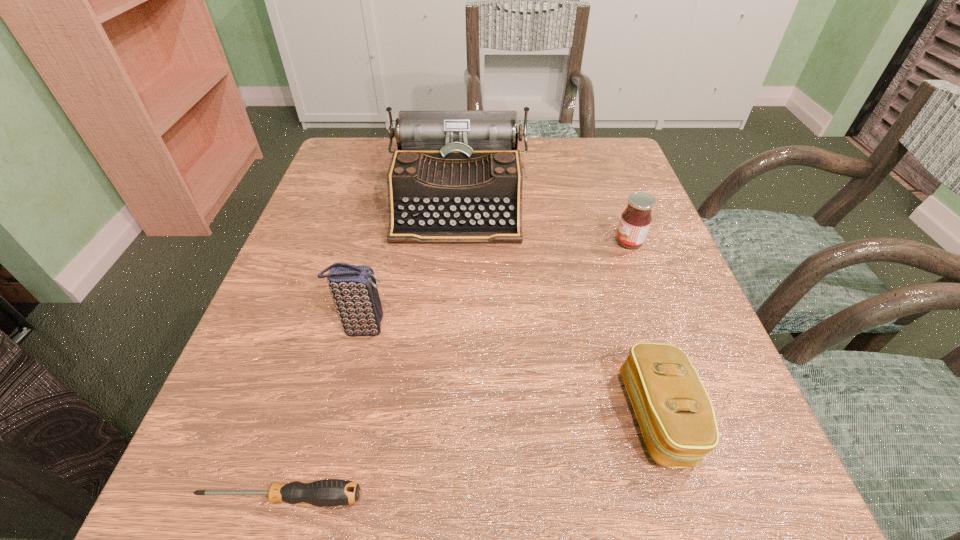
This screenshot has height=540, width=960. I want to click on vacant space located on the label side of the jam, so click(497, 242).

Where is `vacant region located 0.250m on the label side of the jam`? The image size is (960, 540). vacant region located 0.250m on the label side of the jam is located at coordinates (492, 242).

What are the coordinates of `vacant space situated on the label side of the jam` in the screenshot? It's located at (532, 242).

You are a GUI agent. You are given a task and a screenshot of the screen. Output one action in this format:
    pyautogui.click(x=<x>, y=<y>)
    Task: Click on the blank space located 0.300m on the zipper side of the fourth farthest object
    The image size is (960, 540).
    Given the screenshot: What is the action you would take?
    pyautogui.click(x=416, y=416)

In order to click on vacant space located 0.060m on the zipper side of the fourth farthest object in this screenshot , I will do `click(584, 416)`.

Identify the location of vacant space located 0.290m on the zipper side of the fourth farthest object. The image size is (960, 540). (423, 416).

Identify the location of free location located 0.350m on the right of the screwdriver. (642, 497).

The image size is (960, 540). I want to click on object that is positioned at the far edge, so click(x=456, y=177).

Where is `clutch bag that is at the near edge`? This screenshot has height=540, width=960. clutch bag that is at the near edge is located at coordinates (675, 414).

I want to click on screwdriver present at the near edge, so click(x=330, y=492).